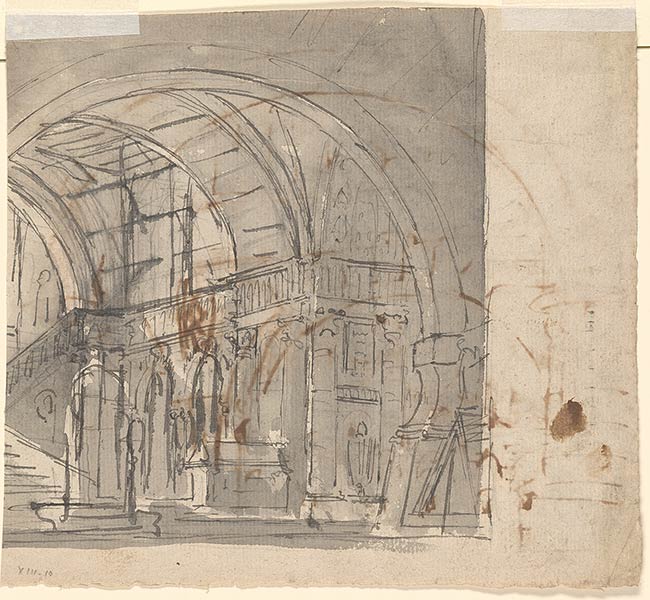
Locate an element on the screen. ceiling is located at coordinates (140, 107).